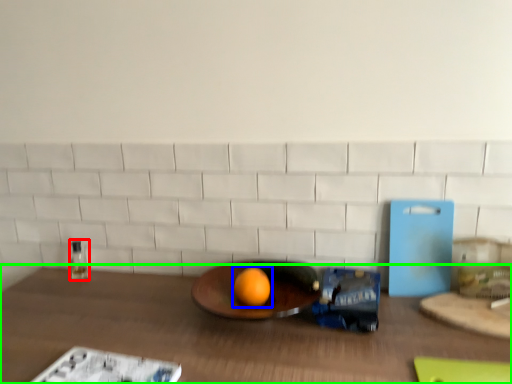
Question: Based on their relative distances, which object is nearer to bottle (highlighted by a red box)? Choose from grapefruit (highlighted by a blue box) and table (highlighted by a green box).

Choices:
 (A) grapefruit
 (B) table

Answer: (B)